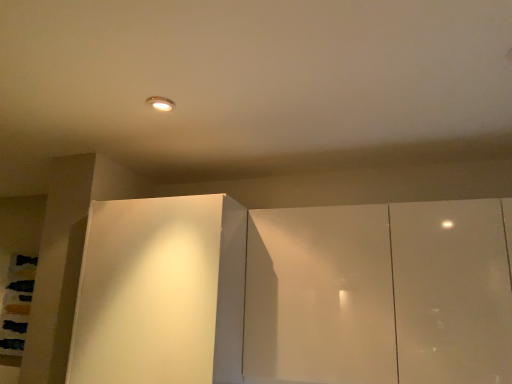
Question: Does glossy white cupboard at center have a lesser height compared to white glossy cabinet at center?

Choices:
 (A) yes
 (B) no

Answer: (A)

Question: Does glossy white cupboard at center contain white glossy cabinet at center?

Choices:
 (A) no
 (B) yes

Answer: (A)

Question: Is glossy white cupboard at center taller than white glossy cabinet at center?

Choices:
 (A) no
 (B) yes

Answer: (A)

Question: Does glossy white cupboard at center have a greater width compared to white glossy cabinet at center?

Choices:
 (A) no
 (B) yes

Answer: (A)

Question: From the image's perspective, does glossy white cupboard at center appear higher than white glossy cabinet at center?

Choices:
 (A) no
 (B) yes

Answer: (B)

Question: Is glossy white cupboard at center located outside white glossy cabinet at center?

Choices:
 (A) yes
 (B) no

Answer: (A)

Question: Is the position of white glossy cabinet at center less distant than that of glossy white cupboard at center?

Choices:
 (A) yes
 (B) no

Answer: (B)

Question: From a real-world perspective, is white glossy cabinet at center located higher than glossy white cupboard at center?

Choices:
 (A) no
 (B) yes

Answer: (A)

Question: Considering the relative sizes of white glossy cabinet at center and glossy white cupboard at center in the image provided, is white glossy cabinet at center thinner than glossy white cupboard at center?

Choices:
 (A) yes
 (B) no

Answer: (B)

Question: Can you confirm if white glossy cabinet at center is bigger than glossy white cupboard at center?

Choices:
 (A) no
 (B) yes

Answer: (B)

Question: From the image's perspective, is white glossy cabinet at center on glossy white cupboard at center?

Choices:
 (A) no
 (B) yes

Answer: (A)

Question: From the image's perspective, is white glossy cabinet at center located beneath glossy white cupboard at center?

Choices:
 (A) no
 (B) yes

Answer: (B)

Question: In the image, is glossy white cupboard at center positioned in front of or behind white glossy cabinet at center?

Choices:
 (A) front
 (B) behind

Answer: (A)